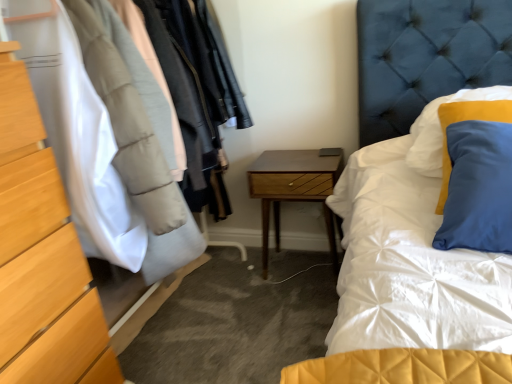
Question: Considering the relative sizes of woodenmaterial/texturenightstand at center and wooden dresser at left in the image provided, is woodenmaterial/texturenightstand at center shorter than wooden dresser at left?

Choices:
 (A) yes
 (B) no

Answer: (A)

Question: Considering the relative sizes of woodenmaterial/texturenightstand at center and wooden dresser at left in the image provided, is woodenmaterial/texturenightstand at center thinner than wooden dresser at left?

Choices:
 (A) no
 (B) yes

Answer: (B)

Question: From the image's perspective, is woodenmaterial/texturenightstand at center located beneath wooden dresser at left?

Choices:
 (A) no
 (B) yes

Answer: (B)

Question: Is woodenmaterial/texturenightstand at center touching wooden dresser at left?

Choices:
 (A) yes
 (B) no

Answer: (B)

Question: Can you confirm if woodenmaterial/texturenightstand at center is taller than wooden dresser at left?

Choices:
 (A) yes
 (B) no

Answer: (B)

Question: Can you confirm if woodenmaterial/texturenightstand at center is positioned to the left of wooden dresser at left?

Choices:
 (A) no
 (B) yes

Answer: (A)

Question: Is wooden dresser at left next to matte wood chest of drawers at left and touching it?

Choices:
 (A) no
 (B) yes

Answer: (B)

Question: Does wooden dresser at left have a larger size compared to matte wood chest of drawers at left?

Choices:
 (A) no
 (B) yes

Answer: (B)

Question: Does wooden dresser at left have a greater width compared to matte wood chest of drawers at left?

Choices:
 (A) yes
 (B) no

Answer: (A)

Question: Could you tell me if wooden dresser at left is facing matte wood chest of drawers at left?

Choices:
 (A) no
 (B) yes

Answer: (A)

Question: Is wooden dresser at left located outside matte wood chest of drawers at left?

Choices:
 (A) yes
 (B) no

Answer: (A)

Question: From a real-world perspective, is wooden dresser at left physically below matte wood chest of drawers at left?

Choices:
 (A) yes
 (B) no

Answer: (B)

Question: Is wooden dresser at left in contact with woodenmaterial/texturenightstand at center?

Choices:
 (A) yes
 (B) no

Answer: (B)